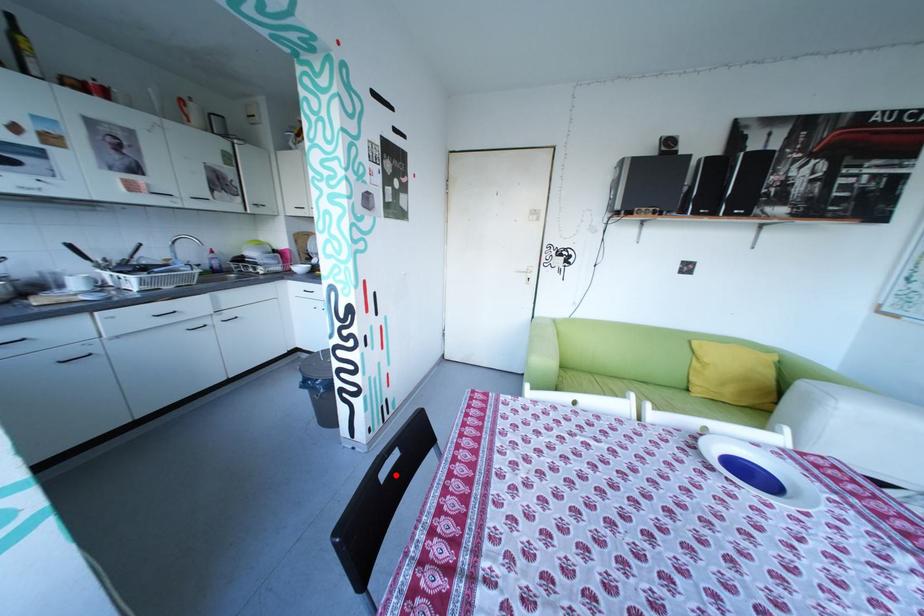
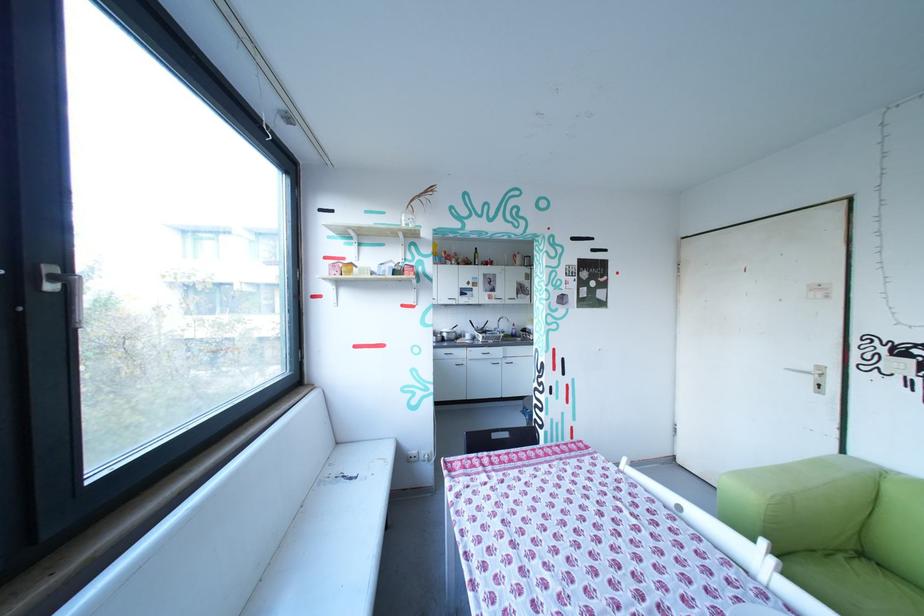
Find the pixel in the second image that matches the highlighted location in the first image.

(507, 436)